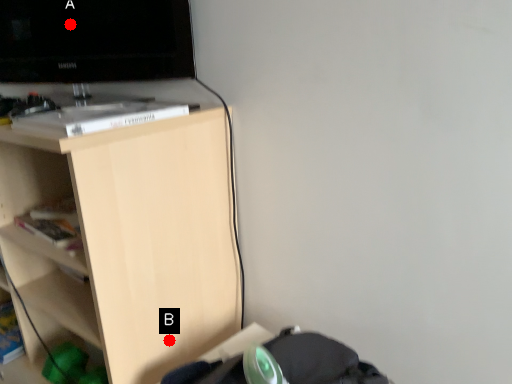
Question: Two points are circled on the image, labeled by A and B beside each circle. Which of the following is the farthest from the observer?

Choices:
 (A) A is further
 (B) B is further

Answer: (A)